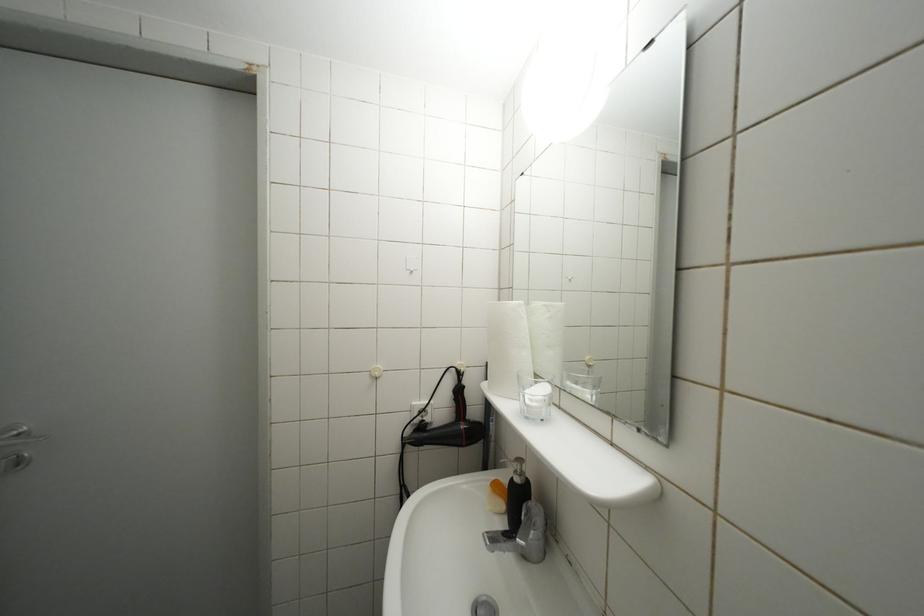
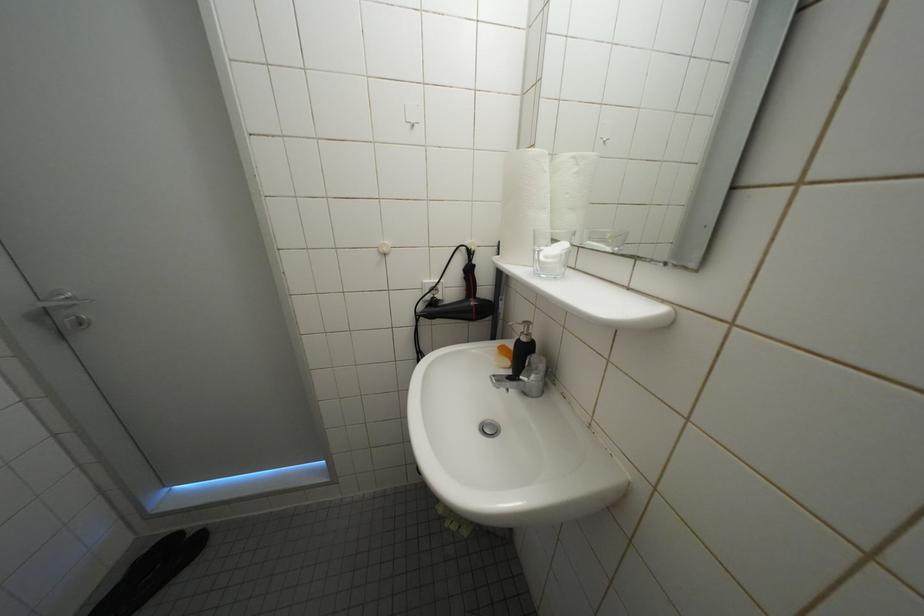
Question: Based on the continuous images, in which direction is the camera rotating? Reply with the corresponding letter.

Choices:
 (A) Left
 (B) Right
 (C) Up
 (D) Down

Answer: (D)